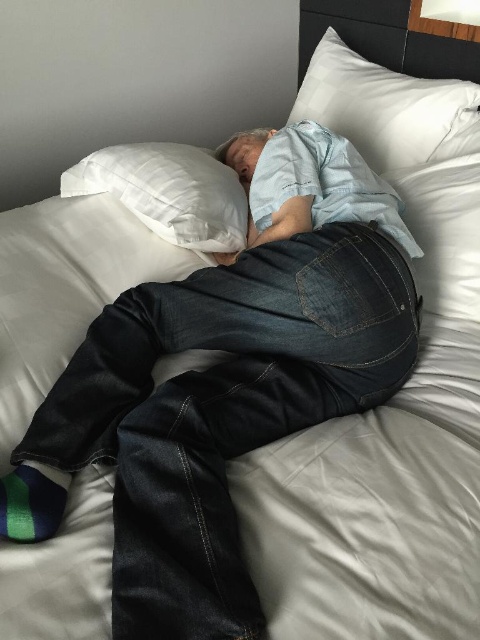
Question: Which point appears closest to the camera in this image?

Choices:
 (A) (72, 164)
 (B) (6, 497)

Answer: (B)

Question: Which is nearer to the white soft pillow at upper right?

Choices:
 (A) multicolored fabric sock at lower left
 (B) white soft pillow at upper left

Answer: (B)

Question: Can you confirm if white soft pillow at upper right is positioned to the left of white soft pillow at upper left?

Choices:
 (A) no
 (B) yes

Answer: (A)

Question: Does white soft pillow at upper right have a smaller size compared to multicolored fabric sock at lower left?

Choices:
 (A) no
 (B) yes

Answer: (A)

Question: Estimate the real-world distances between objects in this image. Which object is closer to the white soft pillow at upper right?

Choices:
 (A) white soft pillow at upper left
 (B) multicolored fabric sock at lower left

Answer: (A)

Question: Is white soft pillow at upper left further to the viewer compared to multicolored fabric sock at lower left?

Choices:
 (A) no
 (B) yes

Answer: (B)